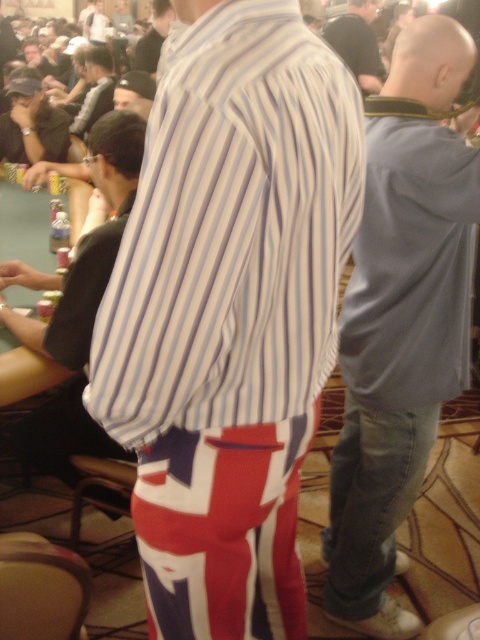
Is matte black cap at upper left wider than dark blue shirt at center?

No, matte black cap at upper left is not wider than dark blue shirt at center.

Between matte black cap at upper left and dark blue shirt at center, which one is positioned higher?

dark blue shirt at center is higher up.

Where is `matte black cap at upper left`? This screenshot has height=640, width=480. matte black cap at upper left is located at coordinates (32, 122).

Does dark blue shirt at center have a lesser height compared to striped shirt at center?

No, dark blue shirt at center is not shorter than striped shirt at center.

The height and width of the screenshot is (640, 480). Describe the element at coordinates (358, 44) in the screenshot. I see `dark blue shirt at center` at that location.

Is point (328, 38) behind point (156, 42)?

No, (328, 38) is in front of (156, 42).

The image size is (480, 640). Find the location of `dark blue shirt at center`. dark blue shirt at center is located at coordinates (358, 44).

Consider the image. Can you confirm if matte black cap at upper left is shorter than striped shirt at center?

No, matte black cap at upper left is not shorter than striped shirt at center.

Who is more distant from viewer, [33,141] or [158,52]?

The point [158,52] is more distant.

Identify the location of matte black cap at upper left. This screenshot has width=480, height=640. (32, 122).